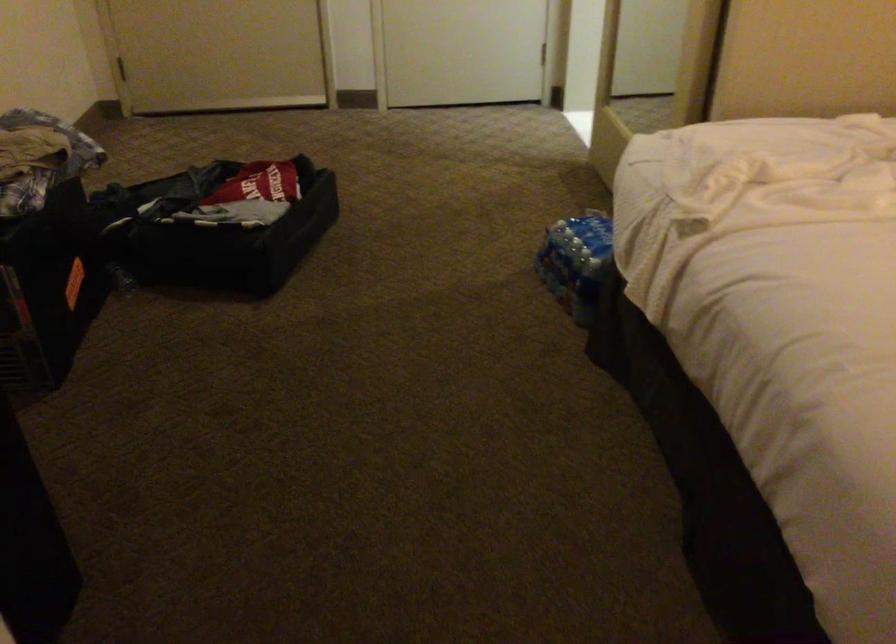
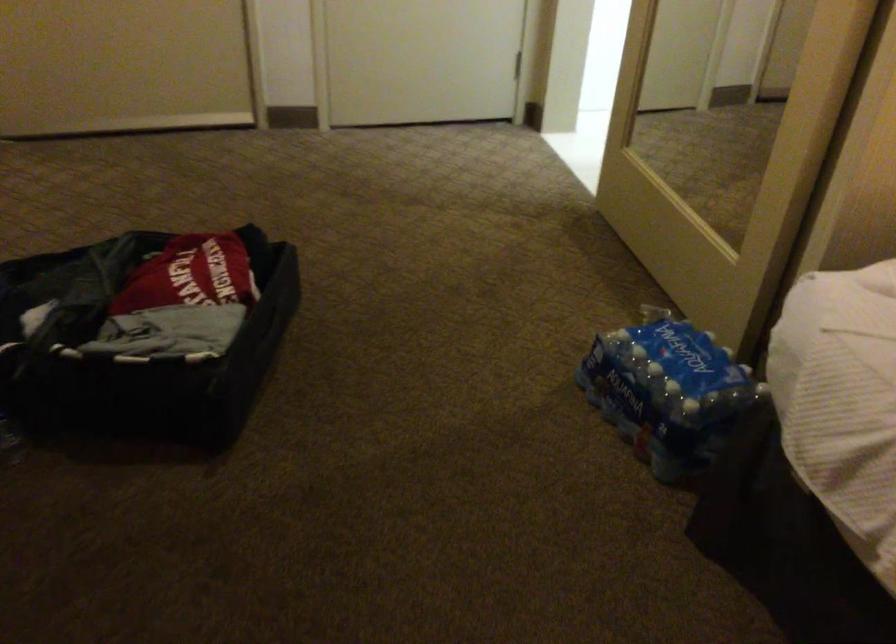
What movement of the cameraman would produce the second image?

The cameraman moved toward left, forward.